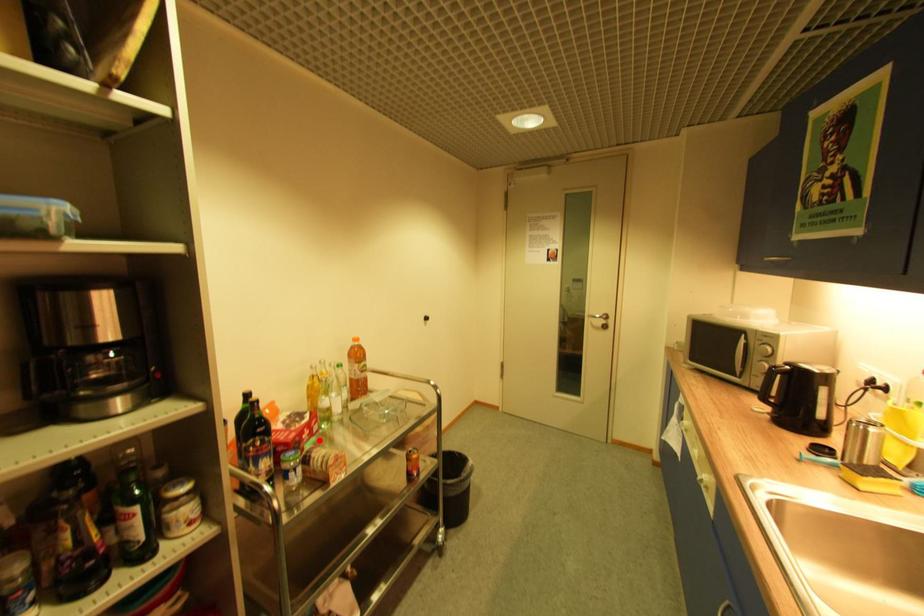
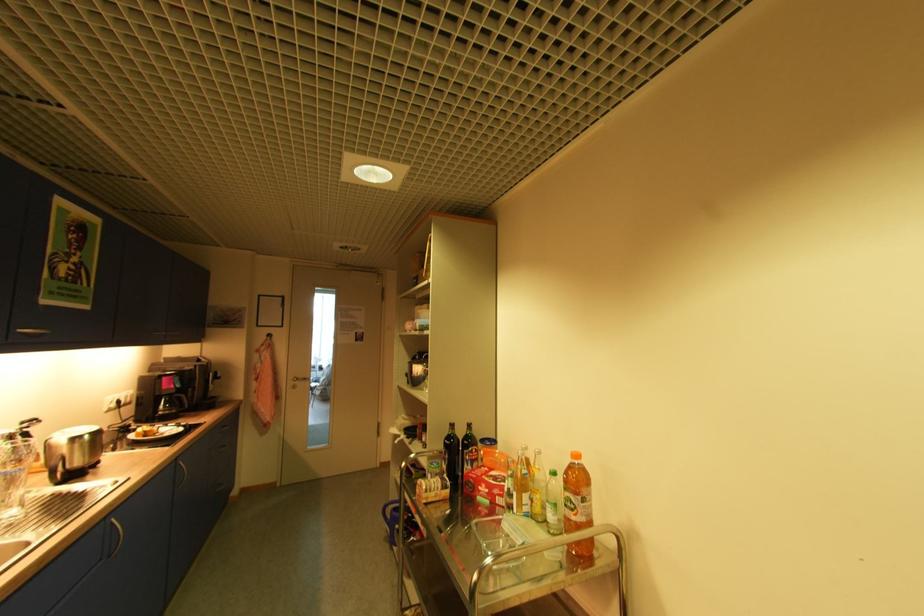
Where in the second image is the point corresponding to the highlighted location from the first image?

(492, 503)